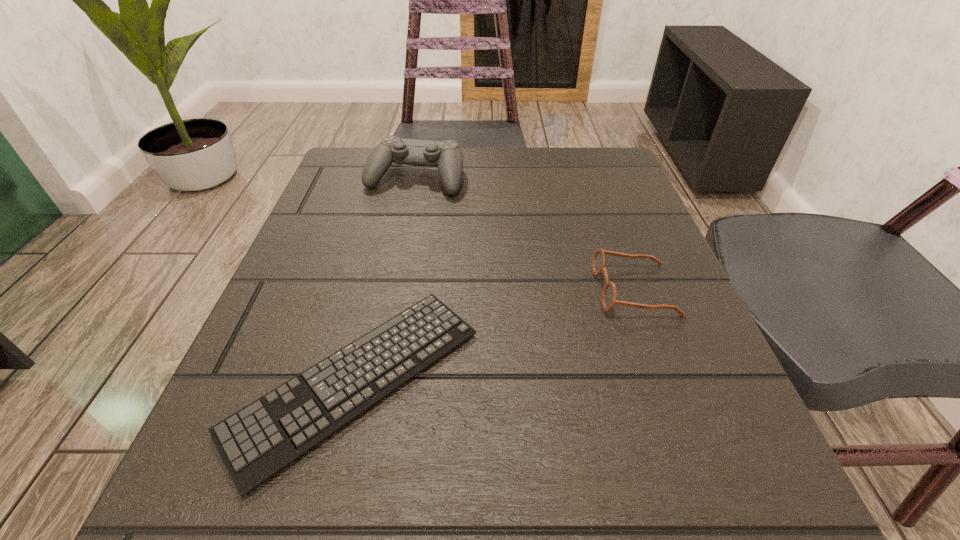
You are a GUI agent. You are given a task and a screenshot of the screen. Output one action in this format:
    pyautogui.click(x=<x>, y=<y>)
    Task: Click on the object positioned at the far edge
    The image size is (960, 540).
    Given the screenshot: What is the action you would take?
    pyautogui.click(x=447, y=156)

Image resolution: width=960 pixels, height=540 pixels. I want to click on object present at the near edge, so click(x=256, y=442).

This screenshot has height=540, width=960. I want to click on control that is at the left edge, so (x=447, y=156).

The image size is (960, 540). I want to click on computer keyboard at the left edge, so click(256, 442).

Image resolution: width=960 pixels, height=540 pixels. Find the location of `object located at the right edge`. object located at the right edge is located at coordinates (608, 297).

Locate an element on the screen. The height and width of the screenshot is (540, 960). object present at the far left corner is located at coordinates (447, 156).

Find the location of a particular element. Image resolution: width=960 pixels, height=540 pixels. object that is positioned at the near left corner is located at coordinates point(256,442).

In order to click on vacant space at the far edge of the desktop in this screenshot , I will do `click(480, 177)`.

Where is `blank space at the near edge of the desktop`? blank space at the near edge of the desktop is located at coordinates (520, 494).

The image size is (960, 540). In order to click on vacant space at the left edge of the desktop in this screenshot , I will do `click(376, 260)`.